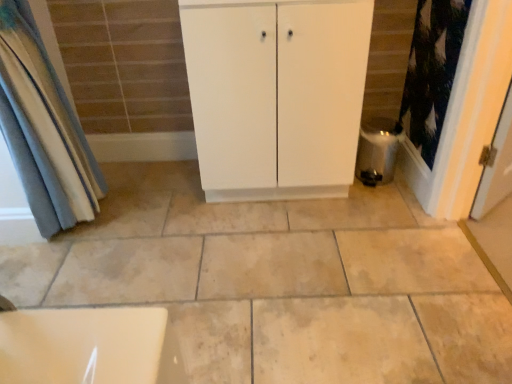
The image size is (512, 384). In order to click on vacant area that lies between white matte cabinet at center and blue fabric curtain at left in this screenshot , I will do `click(170, 211)`.